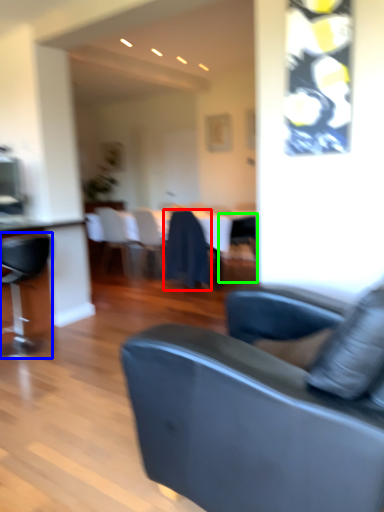
Question: Estimate the real-world distances between objects in this image. Which object is farther from chair (highlighted by a red box), chair (highlighted by a blue box) or chair (highlighted by a green box)?

Choices:
 (A) chair
 (B) chair

Answer: (A)